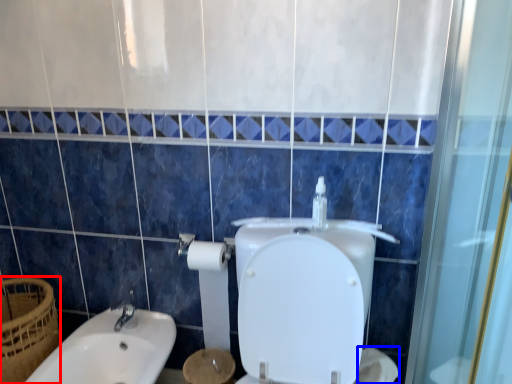
Question: Which object is further to the camera taking this photo, basket (highlighted by a red box) or toilet paper (highlighted by a blue box)?

Choices:
 (A) basket
 (B) toilet paper

Answer: (A)